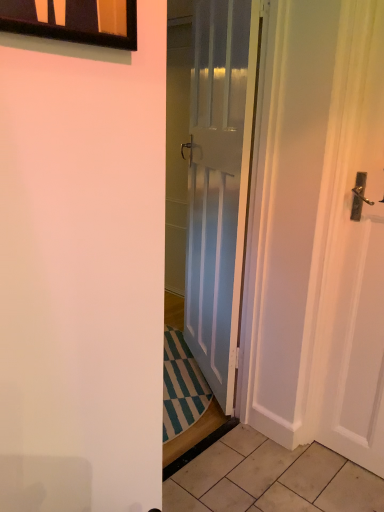
Question: Choose the correct answer: Is black glass window at upper left inside beige tile at lower right or outside it?

Choices:
 (A) outside
 (B) inside

Answer: (A)

Question: Considering their positions, is black glass window at upper left located in front of or behind beige tile at lower right?

Choices:
 (A) front
 (B) behind

Answer: (A)

Question: Based on their relative distances, which object is farther from the beige tile at lower right?

Choices:
 (A) black glass window at upper left
 (B) white glossy door at center

Answer: (A)

Question: Estimate the real-world distances between objects in this image. Which object is closer to the beige tile at lower right?

Choices:
 (A) white glossy door at center
 (B) black glass window at upper left

Answer: (A)